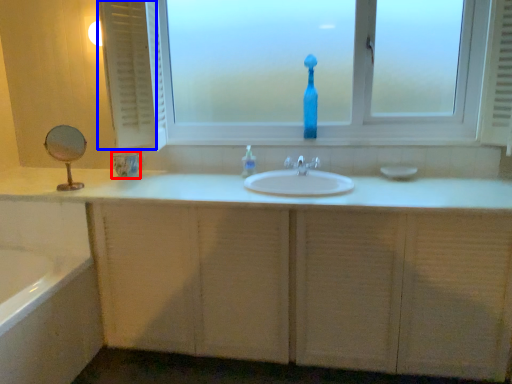
Question: Which of the following is the farthest to the observer, glass vase (highlighted by a red box) or curtain (highlighted by a blue box)?

Choices:
 (A) glass vase
 (B) curtain

Answer: (A)